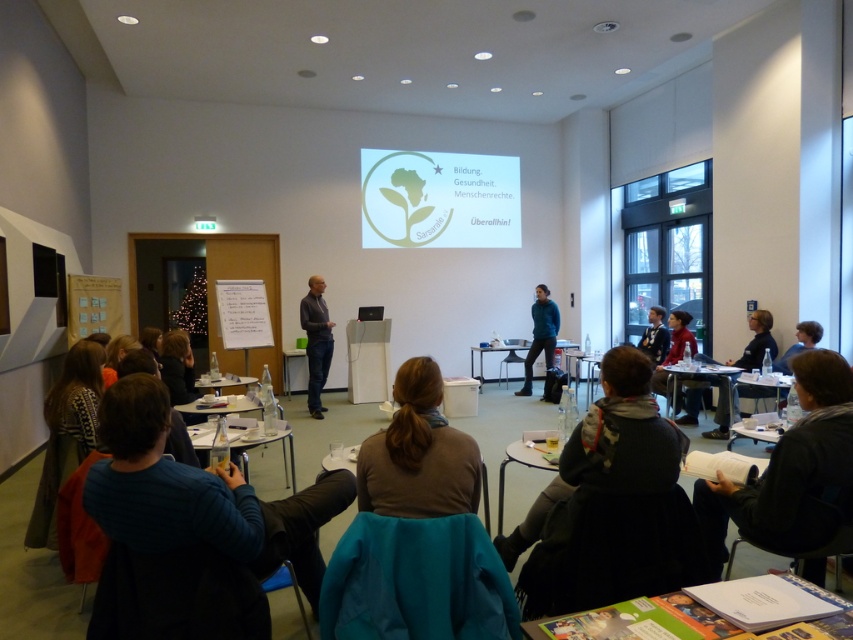
In the scene shown: You are a participant in the conference and need to place a large laptop on the table. Which table, the wooden round table at lower center or the clear plastic table at center, would be more suitable for placing the laptop?

The wooden round table at lower center is much taller than the clear plastic table at center, so it would be more suitable for placing the large laptop as it offers a more stable and comfortable height for use.

You are standing at the center of the conference room and want to move to the white plastic table at lower right. Which direction should you walk to reach it?

Since the white plastic table at lower right is located at point 0.609 on the x axis and 0.892 on the y axis, you should walk towards the lower right direction to reach it.